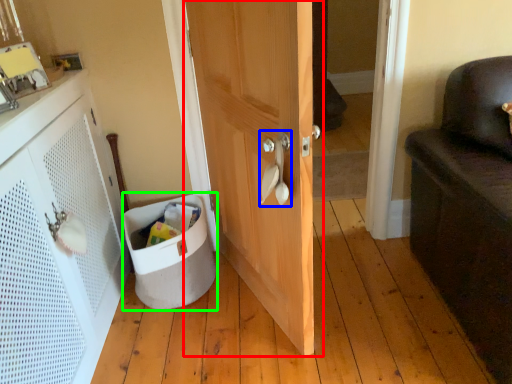
Question: Which object is the farthest from door (highlighted by a red box)? Choose among these: door handle (highlighted by a blue box) or laundry basket (highlighted by a green box).

Choices:
 (A) door handle
 (B) laundry basket

Answer: (B)